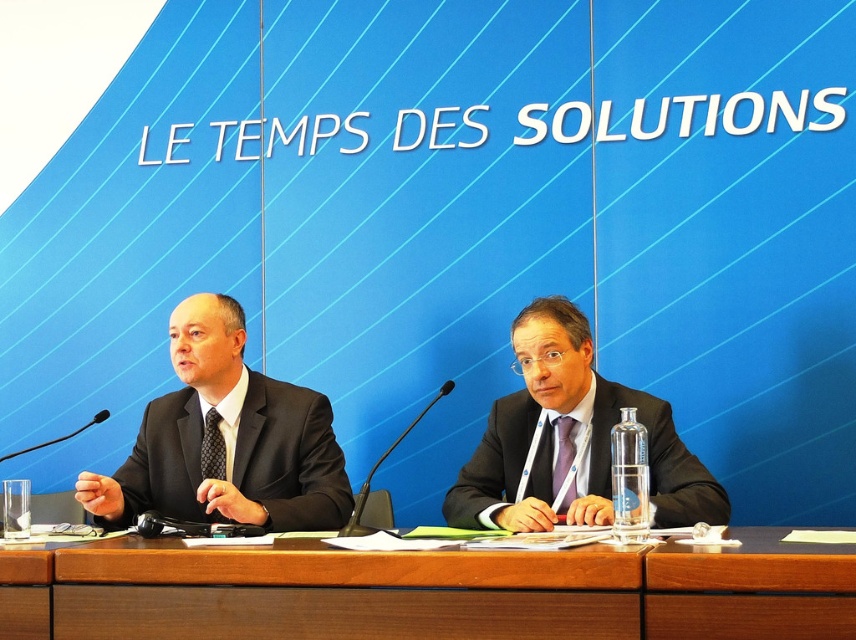
Is black matte suit at left to the right of matte black suit at center from the viewer's perspective?

No, black matte suit at left is not to the right of matte black suit at center.

Which is more to the left, black matte suit at left or matte black suit at center?

From the viewer's perspective, black matte suit at left appears more on the left side.

This screenshot has height=640, width=856. What do you see at coordinates (287, 456) in the screenshot?
I see `black matte suit at left` at bounding box center [287, 456].

Find the location of `black matte suit at left`. black matte suit at left is located at coordinates tap(287, 456).

Who is lower down, brown wood table at center or black matte suit at left?

brown wood table at center is lower down.

How far apart are brown wood table at center and black matte suit at left?

brown wood table at center is 25.32 inches away from black matte suit at left.

Is point (438, 557) positioned in front of point (239, 486)?

Yes, it is.

You are a GUI agent. You are given a task and a screenshot of the screen. Output one action in this format:
    pyautogui.click(x=<x>, y=<y>)
    Task: Click on the brown wood table at center
    The image size is (856, 640).
    Given the screenshot: What is the action you would take?
    pyautogui.click(x=431, y=592)

Does point (107, 540) come in front of point (495, 518)?

Yes, it is.

Who is taller, brown wood table at center or matte black suit at center?

matte black suit at center is taller.

Image resolution: width=856 pixels, height=640 pixels. In order to click on brown wood table at center in this screenshot , I will do `click(431, 592)`.

Locate an element on the screen. brown wood table at center is located at coordinates (431, 592).